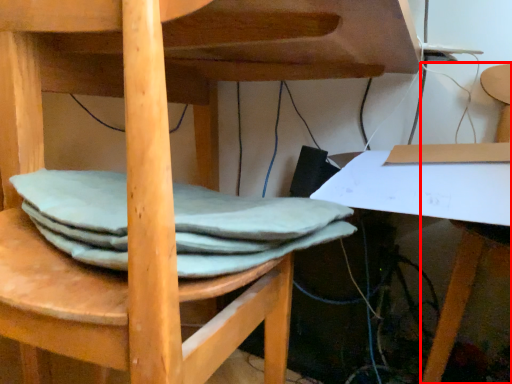
Question: From the image's perspective, what is the correct spatial positioning of chair (annotated by the red box) in reference to fabric?

Choices:
 (A) above
 (B) below

Answer: (B)